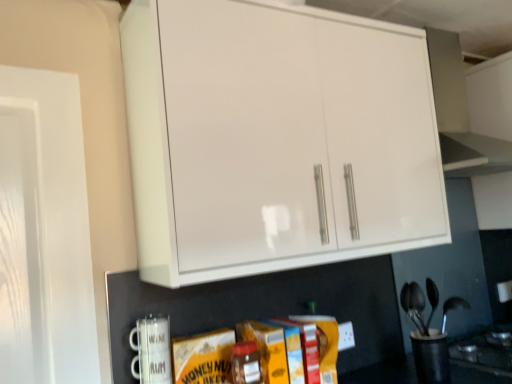
Question: From the image's perspective, does white glossy cabinet at upper center appear lower than matte glass jar at center?

Choices:
 (A) yes
 (B) no

Answer: (B)

Question: Considering the relative sizes of white glossy cabinet at upper center and matte glass jar at center in the image provided, is white glossy cabinet at upper center taller than matte glass jar at center?

Choices:
 (A) yes
 (B) no

Answer: (A)

Question: Is white glossy cabinet at upper center behind matte glass jar at center?

Choices:
 (A) yes
 (B) no

Answer: (B)

Question: Is white glossy cabinet at upper center to the left of matte glass jar at center from the viewer's perspective?

Choices:
 (A) yes
 (B) no

Answer: (B)

Question: Does white glossy cabinet at upper center have a lesser height compared to matte glass jar at center?

Choices:
 (A) yes
 (B) no

Answer: (B)

Question: Is white glossy cabinet at upper center not inside matte glass jar at center?

Choices:
 (A) no
 (B) yes

Answer: (B)

Question: Is the surface of white ceramic mug at lower left, the first appliance from the front, in direct contact with white glossy cabinet at upper center?

Choices:
 (A) yes
 (B) no

Answer: (B)

Question: Is white ceramic mug at lower left, marked as the 2th appliance in a right-to-left arrangement, thinner than white glossy cabinet at upper center?

Choices:
 (A) no
 (B) yes

Answer: (B)

Question: Is white ceramic mug at lower left, the first appliance from the front, outside of white glossy cabinet at upper center?

Choices:
 (A) no
 (B) yes

Answer: (B)

Question: From the image's perspective, is white ceramic mug at lower left, the second appliance viewed from the back, beneath white glossy cabinet at upper center?

Choices:
 (A) no
 (B) yes

Answer: (B)

Question: From a real-world perspective, is white ceramic mug at lower left, the 2th appliance when ordered from bottom to top, on white glossy cabinet at upper center?

Choices:
 (A) no
 (B) yes

Answer: (A)

Question: Considering the relative positions of white ceramic mug at lower left, marked as the first appliance in a top-to-bottom arrangement, and white glossy cabinet at upper center in the image provided, is white ceramic mug at lower left, marked as the first appliance in a top-to-bottom arrangement, in front of white glossy cabinet at upper center?

Choices:
 (A) yes
 (B) no

Answer: (B)

Question: Considering the relative sizes of black plastic utensil holder at lower right, which appears as the 2th appliance when viewed from the left, and white glossy cabinet at upper center in the image provided, is black plastic utensil holder at lower right, which appears as the 2th appliance when viewed from the left, shorter than white glossy cabinet at upper center?

Choices:
 (A) no
 (B) yes

Answer: (B)